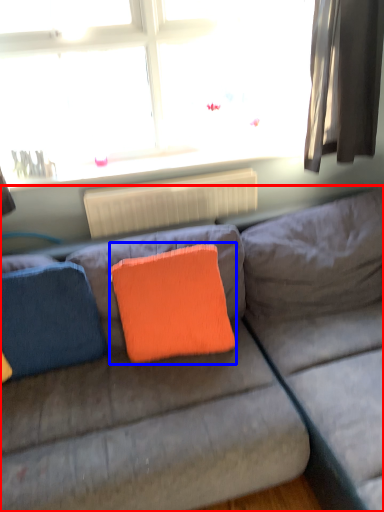
Question: Which object appears closest to the camera in this image, studio couch (highlighted by a red box) or throw pillow (highlighted by a blue box)?

Choices:
 (A) studio couch
 (B) throw pillow

Answer: (A)